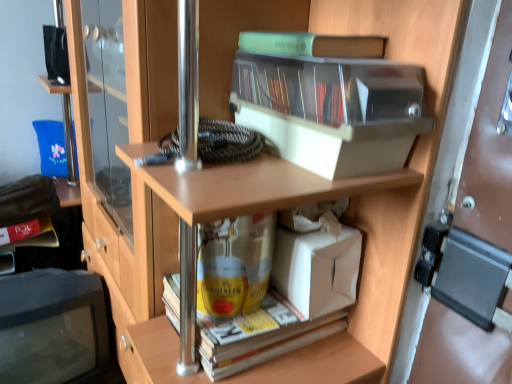
Question: Is transparent plastic storage box at upper center aimed at green plastic book at upper center, the first book positioned from the top?

Choices:
 (A) no
 (B) yes

Answer: (A)

Question: Is transparent plastic storage box at upper center far from green plastic book at upper center, the first book positioned from the top?

Choices:
 (A) yes
 (B) no

Answer: (B)

Question: From the image's perspective, does transparent plastic storage box at upper center appear lower than green plastic book at upper center, positioned as the 1th book in right-to-left order?

Choices:
 (A) yes
 (B) no

Answer: (A)

Question: Is transparent plastic storage box at upper center to the right of green plastic book at upper center, positioned as the 1th book in right-to-left order, from the viewer's perspective?

Choices:
 (A) no
 (B) yes

Answer: (B)

Question: Is transparent plastic storage box at upper center to the left of green plastic book at upper center, arranged as the third book when viewed from the left, from the viewer's perspective?

Choices:
 (A) yes
 (B) no

Answer: (B)

Question: Considering the relative sizes of transparent plastic storage box at upper center and green plastic book at upper center, the 1th book viewed from the front, in the image provided, is transparent plastic storage box at upper center smaller than green plastic book at upper center, the 1th book viewed from the front,?

Choices:
 (A) yes
 (B) no

Answer: (B)

Question: Is yellow paperback book at lower center, which is counted as the second book, starting from the front, at the back of matte black monitor at lower left?

Choices:
 (A) no
 (B) yes

Answer: (A)

Question: Could you tell me if matte black monitor at lower left is turned towards yellow paperback book at lower center, which is counted as the second book, starting from the front?

Choices:
 (A) yes
 (B) no

Answer: (B)

Question: Is matte black monitor at lower left smaller than yellow paperback book at lower center, placed as the second book when sorted from right to left?

Choices:
 (A) yes
 (B) no

Answer: (B)

Question: Considering the relative positions of matte black monitor at lower left and yellow paperback book at lower center, which is counted as the second book, starting from the front, in the image provided, is matte black monitor at lower left behind yellow paperback book at lower center, which is counted as the second book, starting from the front,?

Choices:
 (A) no
 (B) yes

Answer: (B)

Question: From the image's perspective, would you say matte black monitor at lower left is shown under yellow paperback book at lower center, which is the first book from bottom to top?

Choices:
 (A) yes
 (B) no

Answer: (A)

Question: Is matte black monitor at lower left with yellow paperback book at lower center, positioned as the second book in back-to-front order?

Choices:
 (A) yes
 (B) no

Answer: (B)

Question: Considering the relative positions of matte yellow book at lower left, which appears as the second book when viewed from the top, and transparent plastic storage box at upper center in the image provided, is matte yellow book at lower left, which appears as the second book when viewed from the top, to the left of transparent plastic storage box at upper center from the viewer's perspective?

Choices:
 (A) no
 (B) yes

Answer: (B)